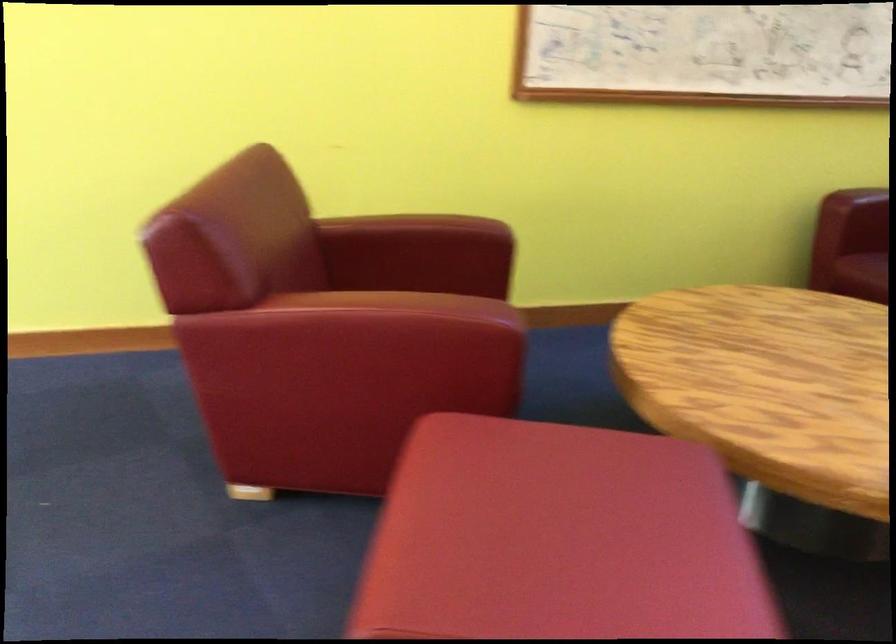
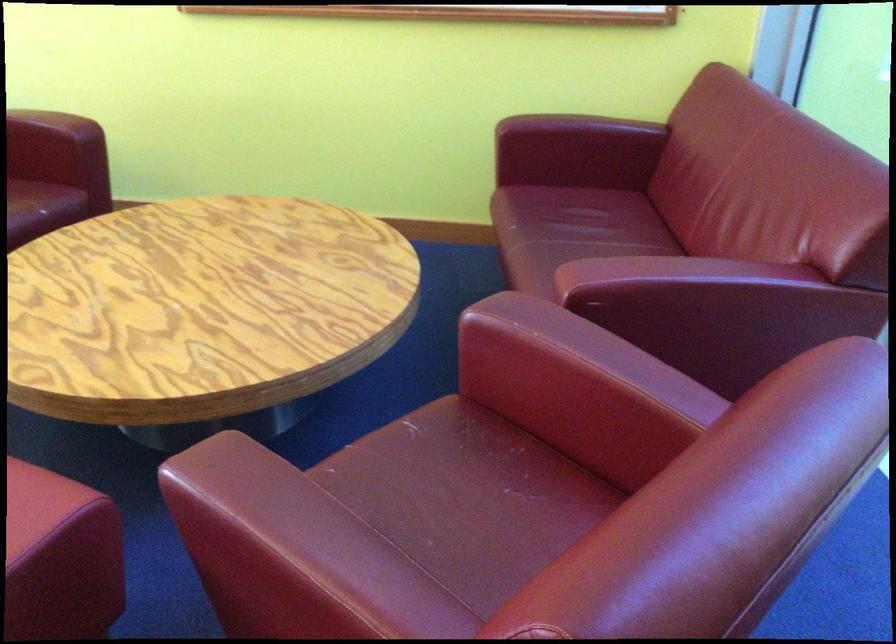
Where in the second image is the point corresponding to pixel 495 234 from the first image?

(55, 122)